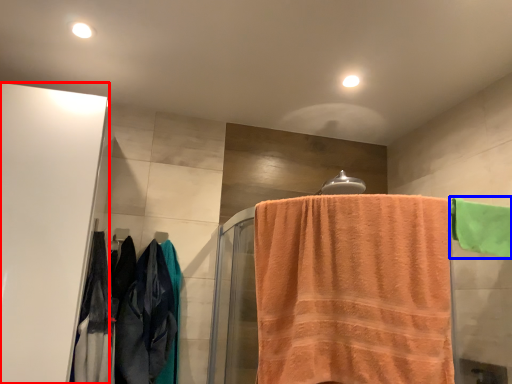
Question: Which point is further to the camera, screen door (highlighted by a red box) or towel (highlighted by a blue box)?

Choices:
 (A) screen door
 (B) towel

Answer: (B)